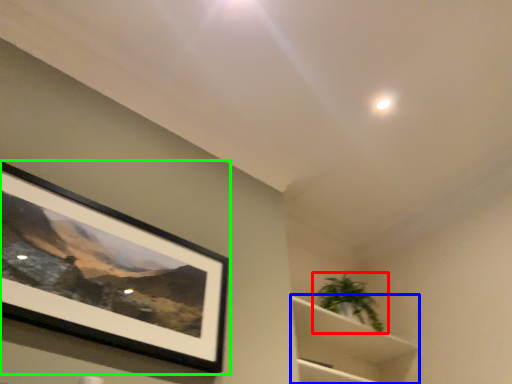
Question: Which object is the closest to the houseplant (highlighted by a red box)? Choose among these: cabinet (highlighted by a blue box) or picture frame (highlighted by a green box).

Choices:
 (A) cabinet
 (B) picture frame

Answer: (A)